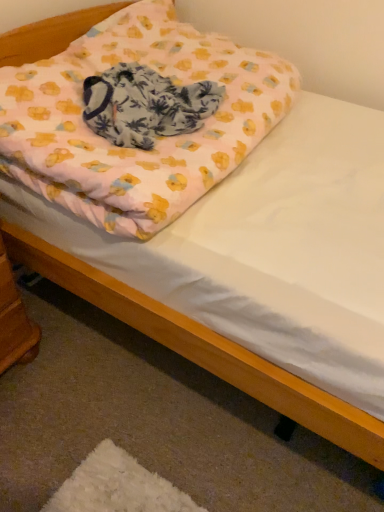
Question: Based on their positions, is pink fabric pillow at upper center located to the left or right of wooden changing table at lower left?

Choices:
 (A) right
 (B) left

Answer: (A)

Question: Considering their positions, is pink fabric pillow at upper center located in front of or behind wooden changing table at lower left?

Choices:
 (A) behind
 (B) front

Answer: (B)

Question: Estimate the real-world distances between objects in this image. Which object is farther from the pink fabric blanket at center?

Choices:
 (A) wooden changing table at lower left
 (B) pink fabric pillow at upper center

Answer: (A)

Question: Estimate the real-world distances between objects in this image. Which object is farther from the pink fabric blanket at center?

Choices:
 (A) pink fabric pillow at upper center
 (B) wooden changing table at lower left

Answer: (B)